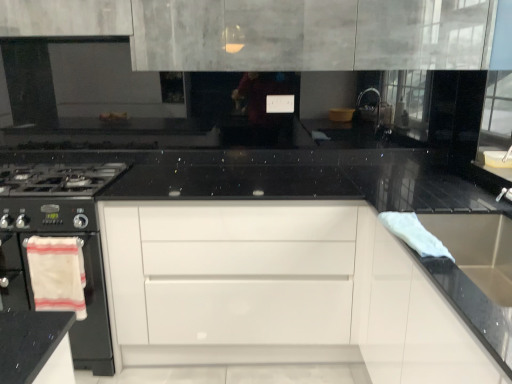
Question: Is the depth of white cotton towel at left, the 2th material viewed from the top, less than that of white glossy drawer at center?

Choices:
 (A) yes
 (B) no

Answer: (A)

Question: Can you confirm if white cotton towel at left, acting as the first material starting from the back, is taller than white glossy drawer at center?

Choices:
 (A) no
 (B) yes

Answer: (A)

Question: Is white glossy drawer at center completely or partially inside white cotton towel at left, acting as the first material starting from the back?

Choices:
 (A) no
 (B) yes

Answer: (A)

Question: Would you say white cotton towel at left, positioned as the first material in left-to-right order, is outside white glossy drawer at center?

Choices:
 (A) yes
 (B) no

Answer: (A)

Question: Considering the relative positions of white cotton towel at left, acting as the first material starting from the back, and white glossy drawer at center in the image provided, is white cotton towel at left, acting as the first material starting from the back, to the left of white glossy drawer at center from the viewer's perspective?

Choices:
 (A) yes
 (B) no

Answer: (A)

Question: Is black matte gas stove at left spatially inside white cotton towel at left, which is the second material from front to back, or outside of it?

Choices:
 (A) inside
 (B) outside

Answer: (B)

Question: Does point (68, 213) appear closer or farther from the camera than point (67, 279)?

Choices:
 (A) farther
 (B) closer

Answer: (B)

Question: In the image, is black matte gas stove at left positioned in front of or behind white cotton towel at left, acting as the first material starting from the back?

Choices:
 (A) front
 (B) behind

Answer: (A)

Question: From the image's perspective, is black matte gas stove at left positioned above or below white cotton towel at left, the 2th material viewed from the top?

Choices:
 (A) above
 (B) below

Answer: (A)

Question: Is point (265, 226) positioned closer to the camera than point (417, 243)?

Choices:
 (A) farther
 (B) closer

Answer: (A)

Question: Is white glossy drawer at center taller or shorter than white cloth at right, the 2th material when ordered from left to right?

Choices:
 (A) short
 (B) tall

Answer: (B)

Question: Is white glossy drawer at center situated inside white cloth at right, the 1th material viewed from the top, or outside?

Choices:
 (A) outside
 (B) inside

Answer: (A)

Question: Looking at the image, does white glossy drawer at center seem bigger or smaller compared to white cloth at right, the 1th material when ordered from front to back?

Choices:
 (A) big
 (B) small

Answer: (A)

Question: Is white glossy drawer at center taller or shorter than stainless steel sink at right?

Choices:
 (A) tall
 (B) short

Answer: (A)

Question: Relative to stainless steel sink at right, is white glossy drawer at center in front or behind?

Choices:
 (A) front
 (B) behind

Answer: (B)